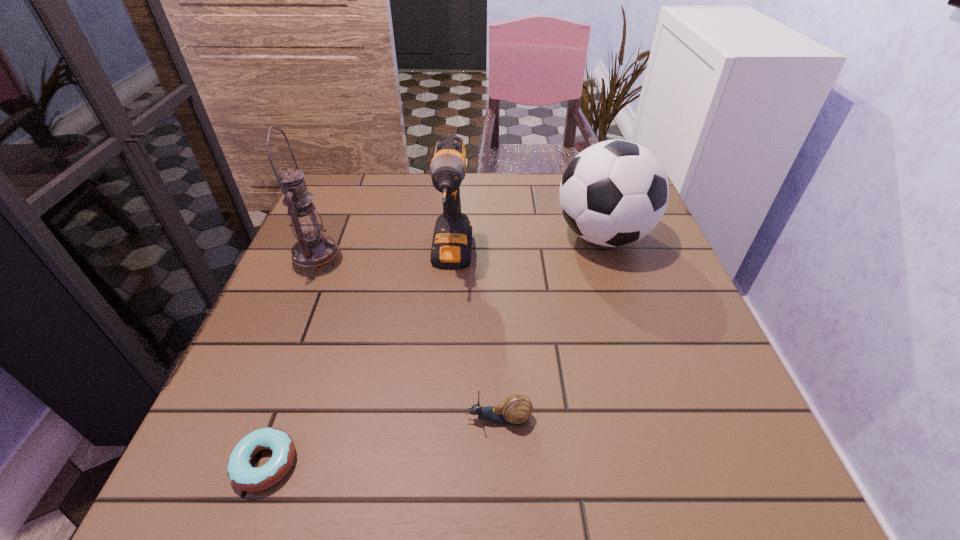
Locate an element on the screen. the tallest object is located at coordinates (314, 254).

Identify the location of drill. (451, 247).

Where is `soccer ball`? This screenshot has width=960, height=540. soccer ball is located at coordinates (613, 193).

Locate an element on the screen. Image resolution: width=960 pixels, height=540 pixels. the fourth tallest object is located at coordinates (x=516, y=409).

You are a GUI agent. You are given a task and a screenshot of the screen. Output one action in this format:
    pyautogui.click(x=<x>, y=<y>)
    Task: Click on the second nearest object
    
    Given the screenshot: What is the action you would take?
    pyautogui.click(x=516, y=409)

At what (x,y) coordinates should I click in order to perform the action: click on the shortest object. Please return your answer as a coordinate pair (x, y). The height and width of the screenshot is (540, 960). Looking at the image, I should click on (242, 475).

Locate an element on the screen. The width and height of the screenshot is (960, 540). the nearest object is located at coordinates (242, 475).

Where is `vacant space located on the front of the oil lamp`? The height and width of the screenshot is (540, 960). vacant space located on the front of the oil lamp is located at coordinates (235, 463).

This screenshot has height=540, width=960. Identify the location of free point located with the drill bit of the drill facing forward. (445, 353).

At what (x,y) coordinates should I click in order to perform the action: click on vacant space located on the left of the rightmost object. Please return your answer as a coordinate pair (x, y). Image resolution: width=960 pixels, height=540 pixels. Looking at the image, I should click on (499, 236).